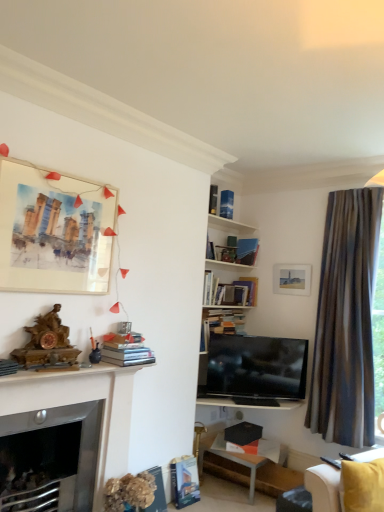
Identify the location of vacant space underneath black glossy tv at center (from a real-world perspective). This screenshot has width=384, height=512. [254, 403].